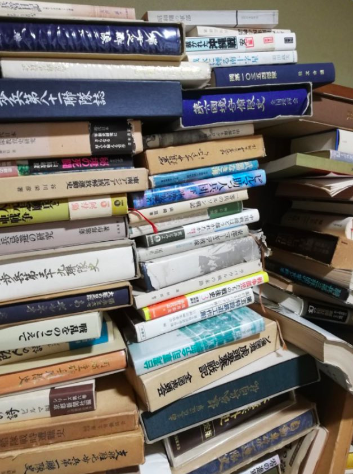
Find the location of a particular element. 9 white books is located at coordinates (80, 326), (82, 267), (173, 293), (192, 315), (173, 73), (275, 56), (269, 40), (206, 32), (31, 406).